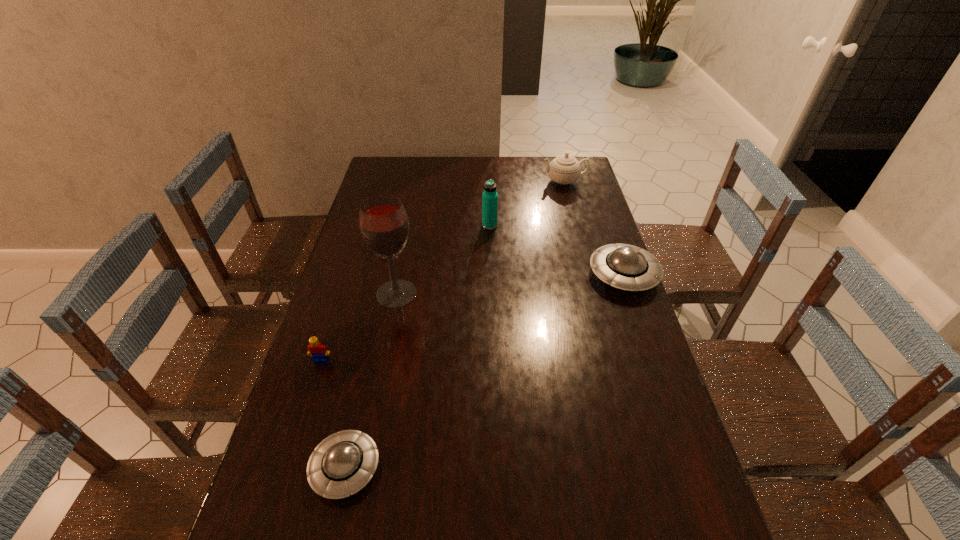
In order to click on the shorter saucer in this screenshot , I will do `click(342, 464)`.

Identify the location of the nearest object. The height and width of the screenshot is (540, 960). (342, 464).

Where is `the farther saucer`? This screenshot has width=960, height=540. the farther saucer is located at coordinates (623, 266).

The height and width of the screenshot is (540, 960). I want to click on the taller saucer, so click(x=623, y=266).

I want to click on the farthest object, so click(x=564, y=169).

Where is `chinaware`? The image size is (960, 540). chinaware is located at coordinates (564, 169).

You are a GUI agent. You are given a task and a screenshot of the screen. Output one action in this format:
    pyautogui.click(x=<x>, y=<y>)
    Task: Click on the fifth nearest object
    
    Given the screenshot: What is the action you would take?
    pyautogui.click(x=489, y=197)

Where is `the fifth shortest object`? the fifth shortest object is located at coordinates (489, 197).

Where is `alcohol`? This screenshot has width=960, height=540. alcohol is located at coordinates (384, 225).

In order to click on Lego in this screenshot , I will do `click(319, 352)`.